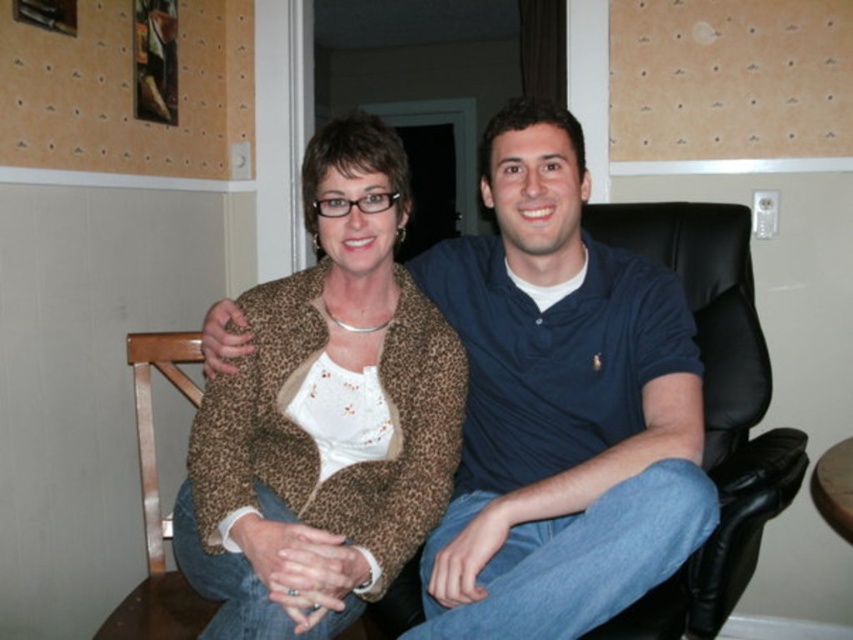
Is blue cotton polo shirt at center taller than brown corkboard at upper center?

Yes, blue cotton polo shirt at center is taller than brown corkboard at upper center.

Can you confirm if blue cotton polo shirt at center is positioned to the right of brown corkboard at upper center?

In fact, blue cotton polo shirt at center is to the left of brown corkboard at upper center.

Does point (549, 179) come farther from viewer compared to point (683, 140)?

No.

In order to click on blue cotton polo shirt at center in this screenshot , I will do pos(560,406).

Between leopard print jacket at center and black leather swivel chair at right, which one is positioned lower?

Positioned lower is black leather swivel chair at right.

Image resolution: width=853 pixels, height=640 pixels. I want to click on leopard print jacket at center, so click(328, 416).

Is blue cotton polo shirt at center wider than leopard print jacket at center?

In fact, blue cotton polo shirt at center might be narrower than leopard print jacket at center.

Is blue cotton polo shirt at center positioned in front of leopard print jacket at center?

Yes, it is in front of leopard print jacket at center.

Identify the location of blue cotton polo shirt at center. (560, 406).